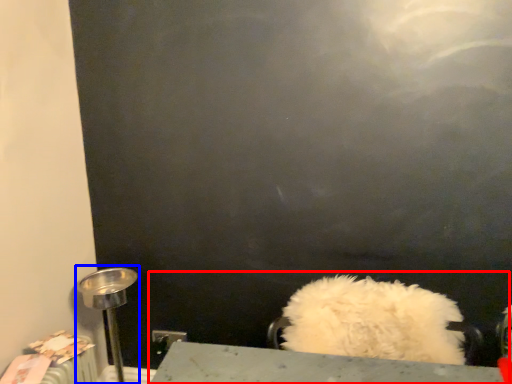
Question: Which object is closer to the camera taking this photo, sink (highlighted by a red box) or table lamp (highlighted by a blue box)?

Choices:
 (A) sink
 (B) table lamp

Answer: (A)